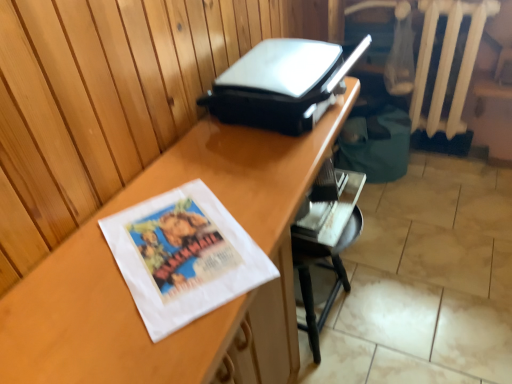
This screenshot has height=384, width=512. Find the location of `free spot above wooden desk at center (from a real-world perspective)`. free spot above wooden desk at center (from a real-world perspective) is located at coordinates (208, 183).